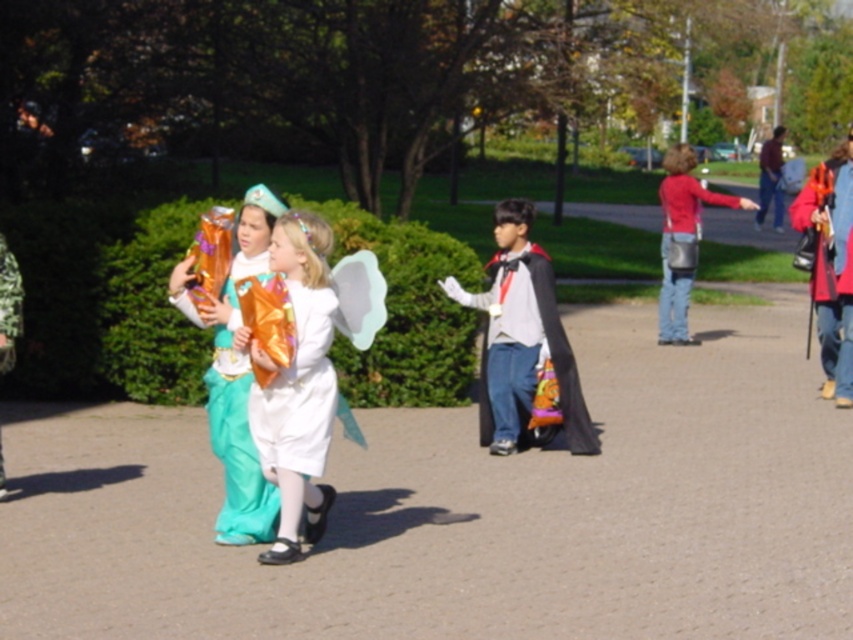
You are a photographer trying to capture the white satin dress at center in your shot. Based on the coordinates provided, where should you position your camera to ensure the dress is centered in the frame?

To center the white satin dress at center in the frame, position your camera so that it aligns with the coordinates point at 0.586 on the x axis and 0.343 on the y axis.

You are a photographer trying to capture a photo of the shiny gold wings at center and the velvet red cape at right. You want to ensure both objects are visible in the frame. Based on their positions, which object should you focus on first to include both in the shot?

The velvet red cape at right is positioned on the right side of shiny gold wings at center, so you should focus on the shiny gold wings at center first as it is closer to the center and the cape is to its right, ensuring both can be framed together.